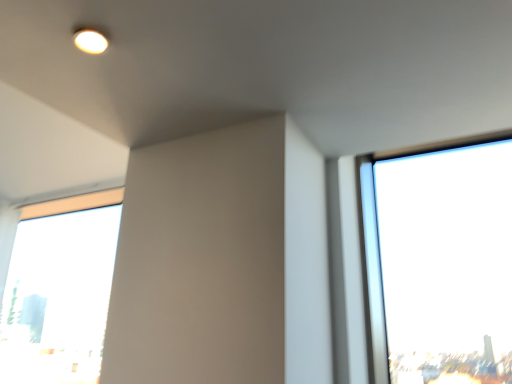
Question: From the image's perspective, is transparent glass window at lower left located above or below matte white light fixture at upper left?

Choices:
 (A) below
 (B) above

Answer: (A)

Question: In terms of height, does transparent glass window at lower left look taller or shorter compared to matte white light fixture at upper left?

Choices:
 (A) short
 (B) tall

Answer: (B)

Question: Would you say transparent glass window at lower left is inside or outside matte white light fixture at upper left?

Choices:
 (A) outside
 (B) inside

Answer: (A)

Question: In terms of width, does matte white light fixture at upper left look wider or thinner when compared to transparent glass window at lower left?

Choices:
 (A) thin
 (B) wide

Answer: (A)

Question: Is matte white light fixture at upper left taller or shorter than transparent glass window at lower left?

Choices:
 (A) short
 (B) tall

Answer: (A)

Question: From the image's perspective, is matte white light fixture at upper left located above or below transparent glass window at lower left?

Choices:
 (A) above
 (B) below

Answer: (A)

Question: In the image, is matte white light fixture at upper left positioned in front of or behind transparent glass window at lower left?

Choices:
 (A) front
 (B) behind

Answer: (A)